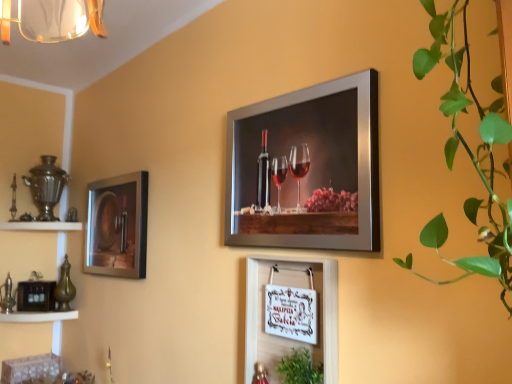
Question: From a real-world perspective, is metallic silver wine bottle at left, which appears as the 3th picture frame when viewed from the front, physically below white wood sign at center, marked as the second picture frame in a right-to-left arrangement?

Choices:
 (A) yes
 (B) no

Answer: (B)

Question: Is metallic silver wine bottle at left, which appears as the 3th picture frame when viewed from the front, at the right side of white wood sign at center, which appears as the second picture frame when viewed from the front?

Choices:
 (A) yes
 (B) no

Answer: (B)

Question: Is metallic silver wine bottle at left, the third picture frame in the right-to-left sequence, outside of white wood sign at center, the 2th picture frame positioned from the back?

Choices:
 (A) yes
 (B) no

Answer: (A)

Question: Would you say metallic silver wine bottle at left, which is counted as the first picture frame, starting from the left, is a long distance from white wood sign at center, marked as the second picture frame in a right-to-left arrangement?

Choices:
 (A) yes
 (B) no

Answer: (B)

Question: From the image's perspective, would you say metallic silver wine bottle at left, the third picture frame in the right-to-left sequence, is shown under white wood sign at center, marked as the second picture frame in a right-to-left arrangement?

Choices:
 (A) yes
 (B) no

Answer: (B)

Question: In the image, is white wood shelf at lower left on the left side or the right side of metallic silver picture frame at upper center, which ranks as the third picture frame in left-to-right order?

Choices:
 (A) left
 (B) right

Answer: (A)

Question: Is white wood shelf at lower left bigger or smaller than metallic silver picture frame at upper center, which ranks as the third picture frame in left-to-right order?

Choices:
 (A) big
 (B) small

Answer: (B)

Question: Is white wood shelf at lower left spatially inside metallic silver picture frame at upper center, which ranks as the third picture frame in left-to-right order, or outside of it?

Choices:
 (A) inside
 (B) outside

Answer: (B)

Question: From a real-world perspective, is white wood shelf at lower left physically located above or below metallic silver picture frame at upper center, positioned as the third picture frame in back-to-front order?

Choices:
 (A) above
 (B) below

Answer: (B)

Question: In terms of height, does white wood shelf at lower left look taller or shorter compared to green leafy plant at right?

Choices:
 (A) tall
 (B) short

Answer: (B)

Question: Looking at the image, does white wood shelf at lower left seem bigger or smaller compared to green leafy plant at right?

Choices:
 (A) small
 (B) big

Answer: (A)

Question: Based on their positions, is white wood shelf at lower left located to the left or right of green leafy plant at right?

Choices:
 (A) right
 (B) left

Answer: (B)

Question: In terms of width, does white wood shelf at lower left look wider or thinner when compared to green leafy plant at right?

Choices:
 (A) thin
 (B) wide

Answer: (B)

Question: From a real-world perspective, is green leafy plant at right physically located above or below white wood sign at center, which appears as the second picture frame when viewed from the front?

Choices:
 (A) above
 (B) below

Answer: (A)

Question: Would you say green leafy plant at right is inside or outside white wood sign at center, which appears as the second picture frame when viewed from the front?

Choices:
 (A) outside
 (B) inside

Answer: (A)